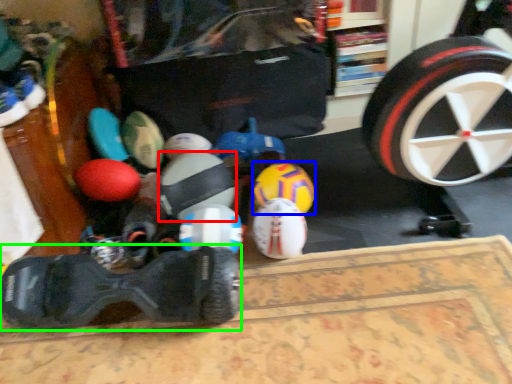
Question: Estimate the real-world distances between objects in this image. Which object is closer to toy (highlighted by a red box), toy (highlighted by a blue box) or footwear (highlighted by a green box)?

Choices:
 (A) toy
 (B) footwear

Answer: (A)